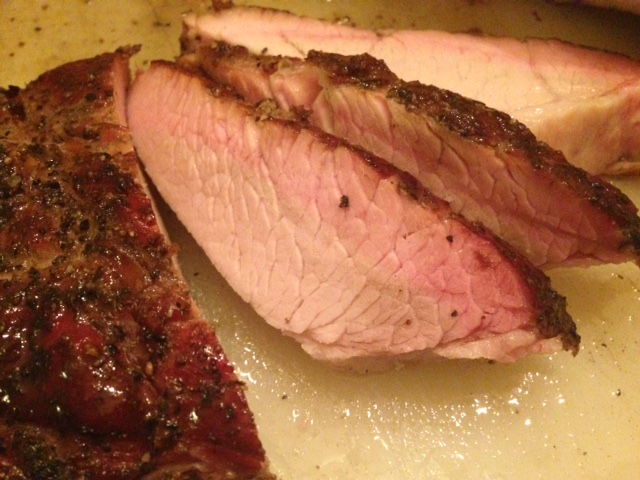
Locate an element on the screen. This screenshot has width=640, height=480. plate is located at coordinates (444, 411).